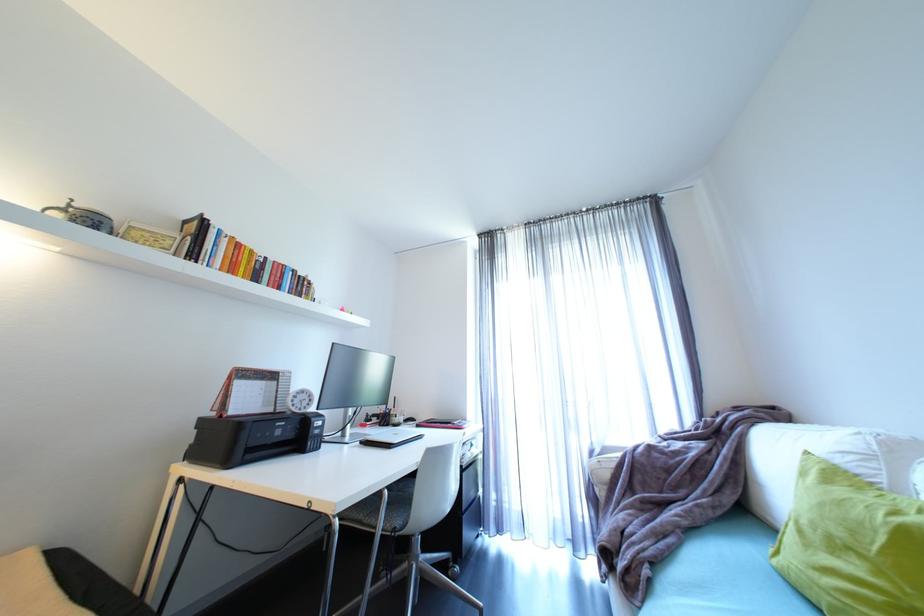
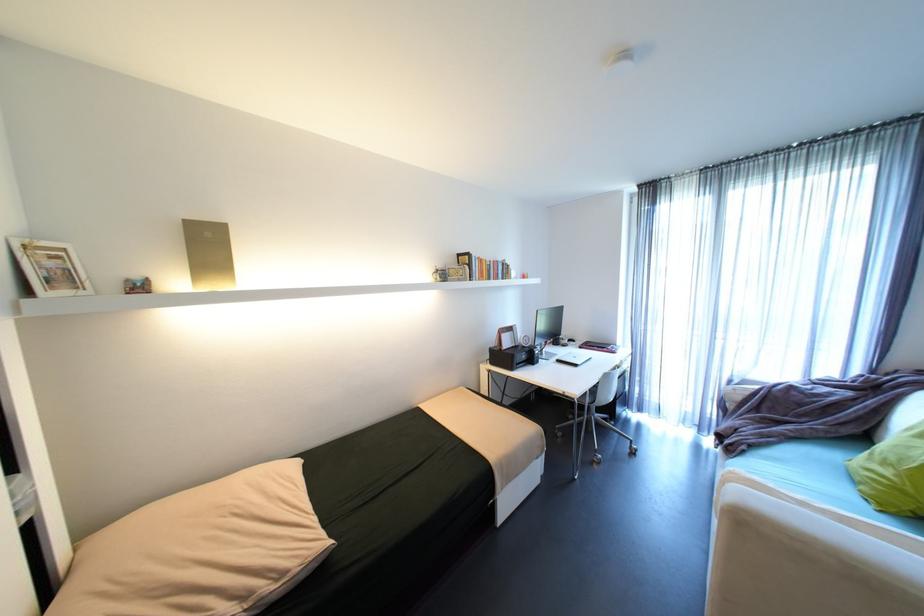
Find the pixel in the second image that matches point 658,582 in the first image.

(751, 451)